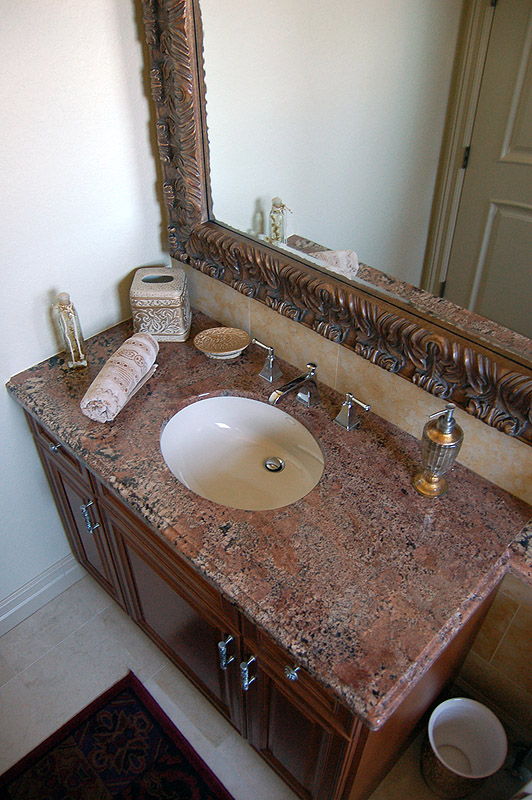
Locate an element on the screen. Image resolution: width=532 pixels, height=800 pixels. decorative tissue paper cover is located at coordinates (166, 308).